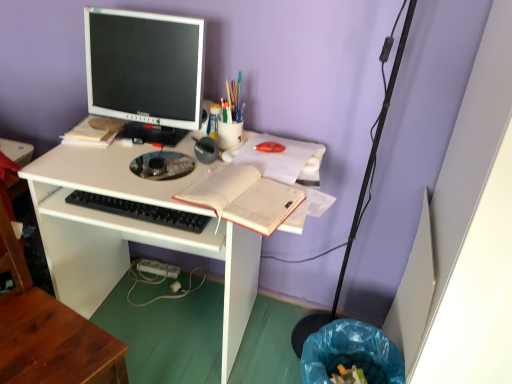
Locate an element on the screen. The width and height of the screenshot is (512, 384). free point in front of metallic gray pen at center, marked as the third stationery in a back-to-front arrangement is located at coordinates (170, 188).